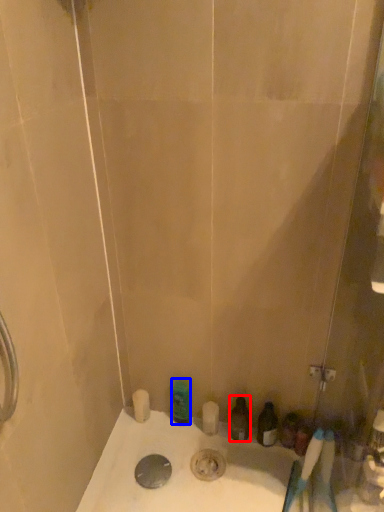
Question: Which of the following is the farthest to the observer, toiletry (highlighted by a red box) or toiletry (highlighted by a blue box)?

Choices:
 (A) toiletry
 (B) toiletry

Answer: (B)